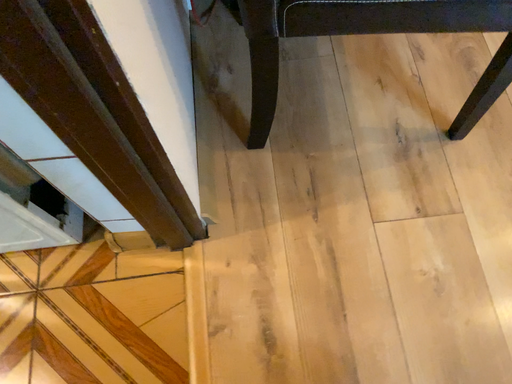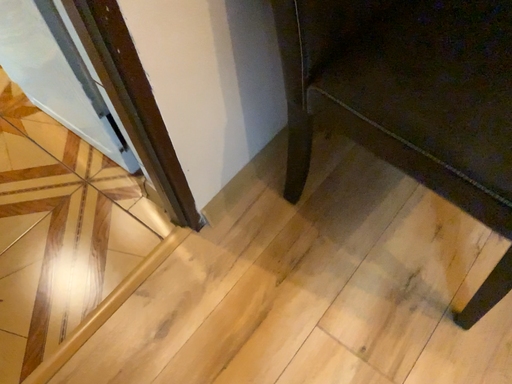
Question: Which way did the camera rotate in the video?

Choices:
 (A) rotated right
 (B) rotated left

Answer: (B)